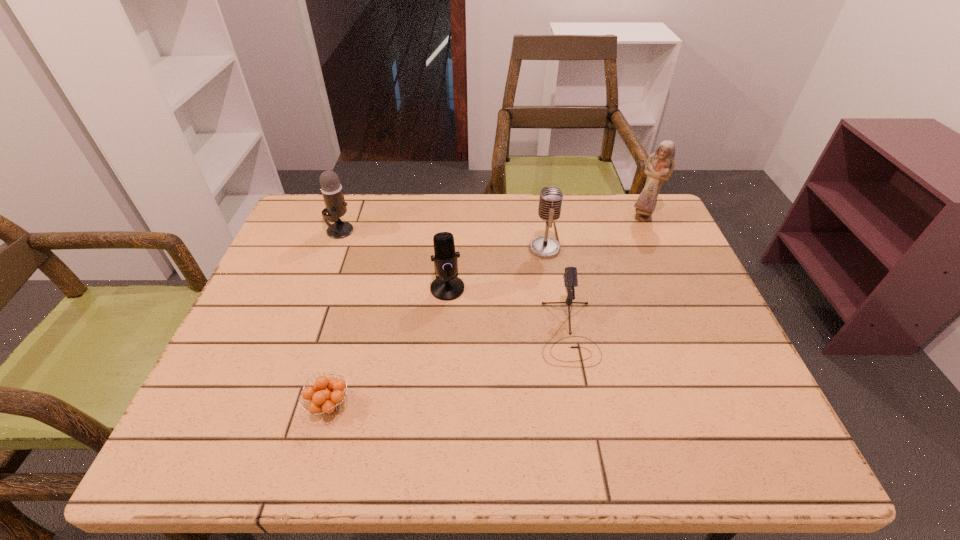
Locate an element on the screen. This screenshot has width=960, height=540. the rightmost object is located at coordinates (659, 166).

Find the location of a particular element. the tallest object is located at coordinates (659, 166).

Identify the location of the leftmost object. coord(331,189).

Identify the location of the fourth tallest object. The image size is (960, 540). (447, 286).

Locate an element on the screen. the third microphone from right to left is located at coordinates (447, 286).

This screenshot has width=960, height=540. I want to click on the shortest microphone, so click(571, 281).

I want to click on orange fruit, so tap(323, 400).

Locate an element on the screen. This screenshot has height=540, width=960. the nearest object is located at coordinates (323, 400).

Locate an element on the screen. The image size is (960, 540). vacant space situated 0.250m on the front-facing side of the rightmost object is located at coordinates (673, 285).

Find the location of a particular element. Image resolution: width=960 pixels, height=540 pixels. vacant region located on the front of the leftmost object is located at coordinates (323, 278).